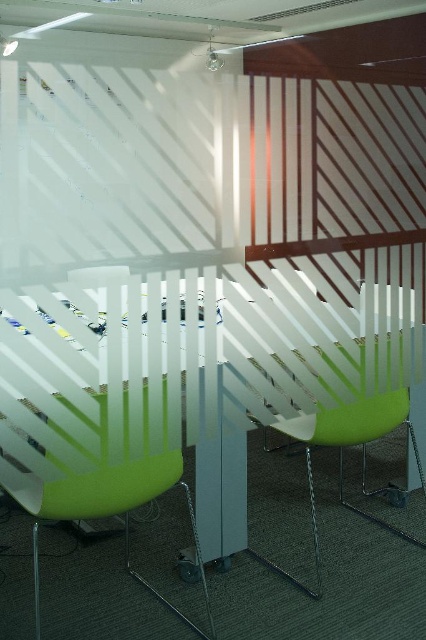
You are an office worker who needs to adjust your desk height to match your chair for proper ergonomics. You have a transparent plastic table at center and a green matte chair at center in your view. Which object should you lower to ensure comfortable posture?

The transparent plastic table at center is much taller than the green matte chair at center, so you should lower the transparent plastic table at center to match the height of the green matte chair at center for proper ergonomics.

You are organizing a meeting in this office and need to arrange the chairs. If you want to move the matte green plastic chair at left closer to the green matte chair at center, which direction should you move it?

The matte green plastic chair at left is already positioned on the left side of the green matte chair at center. To move it closer, you should move it to the right towards the green matte chair at center.

You are organizing a meeting in the office. You need to place a new rectangular box that is 1.2 meters wide on the table. Can the transparent plastic table at center accommodate the green matte chair at center and the box without overlapping?

The transparent plastic table at center is bigger than the green matte chair at center, so it can accommodate both the green matte chair at center and the box as long as their combined dimensions do not exceed the table size.